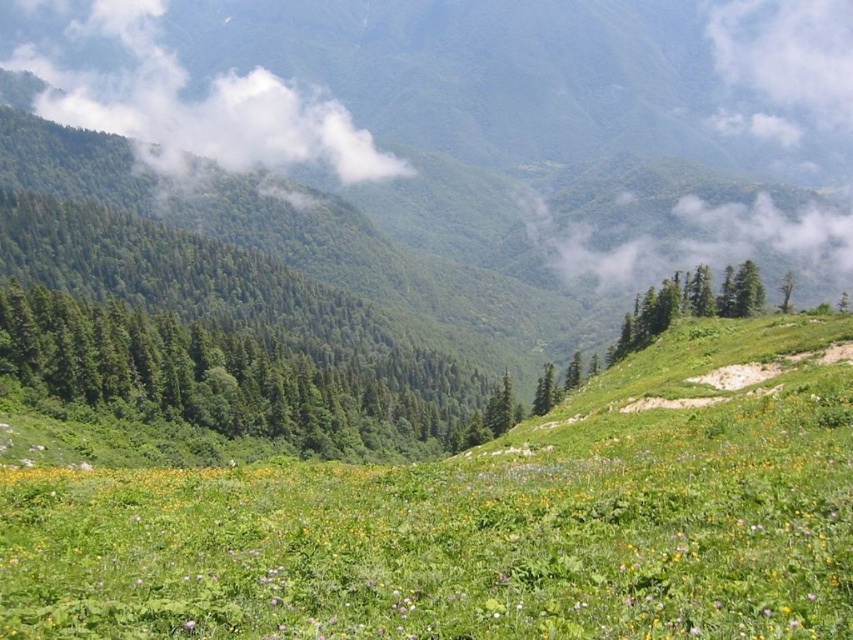
Question: Which of the following is the closest to the observer?

Choices:
 (A) (323, 131)
 (B) (780, 305)

Answer: (B)

Question: Can you confirm if white fluffy cloud at upper left is positioned to the left of green leafy tree at upper right?

Choices:
 (A) yes
 (B) no

Answer: (A)

Question: Is white fluffy cloud at upper left closer to camera compared to green leafy tree at upper right?

Choices:
 (A) yes
 (B) no

Answer: (B)

Question: Does white fluffy cloud at upper left have a larger size compared to green leafy tree at upper right?

Choices:
 (A) no
 (B) yes

Answer: (B)